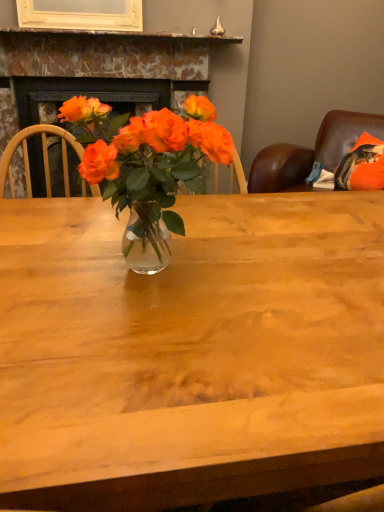
At what (x,y) coordinates should I click in order to perform the action: click on translucent glass vase at center. Please return your answer as a coordinate pair (x, y). Image resolution: width=384 pixels, height=512 pixels. Looking at the image, I should click on click(x=148, y=167).

Based on the photo, what is the approximate height of translucent glass vase at center?

The height of translucent glass vase at center is 38.02 centimeters.

This screenshot has width=384, height=512. What do you see at coordinates (148, 167) in the screenshot?
I see `translucent glass vase at center` at bounding box center [148, 167].

The width and height of the screenshot is (384, 512). Describe the element at coordinates (103, 62) in the screenshot. I see `marble fireplace at upper center` at that location.

I want to click on marble fireplace at upper center, so click(103, 62).

You are a GUI agent. You are given a task and a screenshot of the screen. Output one action in this format:
    pyautogui.click(x=<x>, y=<y>)
    Task: Click on the translucent glass vase at center
    
    Given the screenshot: What is the action you would take?
    pyautogui.click(x=148, y=167)

Does translucent glass vase at center appear on the right side of marble fireplace at upper center?

Correct, you'll find translucent glass vase at center to the right of marble fireplace at upper center.

Which is behind, translucent glass vase at center or marble fireplace at upper center?

marble fireplace at upper center is behind.

Which is less distant, [133,213] or [195,44]?

Positioned in front is point [133,213].

From the image's perspective, does translucent glass vase at center appear higher than marble fireplace at upper center?

No, from the image's perspective, translucent glass vase at center is not over marble fireplace at upper center.

From the picture: From a real-world perspective, who is located lower, translucent glass vase at center or marble fireplace at upper center?

From a 3D spatial view, marble fireplace at upper center is below.

Which of these two, translucent glass vase at center or marble fireplace at upper center, is wider?

marble fireplace at upper center.

Considering the sizes of translucent glass vase at center and marble fireplace at upper center in the image, is translucent glass vase at center taller or shorter than marble fireplace at upper center?

Considering their sizes, translucent glass vase at center has less height than marble fireplace at upper center.

Considering the sizes of objects translucent glass vase at center and marble fireplace at upper center in the image provided, who is bigger, translucent glass vase at center or marble fireplace at upper center?

marble fireplace at upper center is bigger.

Is marble fireplace at upper center surrounded by translucent glass vase at center?

No, translucent glass vase at center does not contain marble fireplace at upper center.

Consider the image. Is translucent glass vase at center next to marble fireplace at upper center?

No, translucent glass vase at center is not making contact with marble fireplace at upper center.

Is translucent glass vase at center looking in the opposite direction of marble fireplace at upper center?

translucent glass vase at center does not have its back to marble fireplace at upper center.

Identify the location of fireplace above the translucent glass vase at center (from the image's perspective). (103, 62).

Is marble fireplace at upper center to the left or to the right of translucent glass vase at center in the image?

In the image, marble fireplace at upper center appears on the left side of translucent glass vase at center.

Is marble fireplace at upper center further to the viewer compared to translucent glass vase at center?

Yes, the depth of marble fireplace at upper center is greater than that of translucent glass vase at center.

Which point is more forward, (12, 110) or (170, 147)?

The point (170, 147) is in front.

From the image's perspective, is marble fireplace at upper center beneath translucent glass vase at center?

No, from the image's perspective, marble fireplace at upper center is not below translucent glass vase at center.

From a real-world perspective, does marble fireplace at upper center sit lower than translucent glass vase at center?

Yes.

Can you confirm if marble fireplace at upper center is wider than translucent glass vase at center?

Yes.

Considering the relative sizes of marble fireplace at upper center and translucent glass vase at center in the image provided, is marble fireplace at upper center shorter than translucent glass vase at center?

In fact, marble fireplace at upper center may be taller than translucent glass vase at center.

In terms of size, does marble fireplace at upper center appear bigger or smaller than translucent glass vase at center?

Clearly, marble fireplace at upper center is larger in size than translucent glass vase at center.

Is marble fireplace at upper center located outside translucent glass vase at center?

marble fireplace at upper center lies outside translucent glass vase at center's area.

Are marble fireplace at upper center and translucent glass vase at center far apart?

Yes, marble fireplace at upper center and translucent glass vase at center are quite far apart.

Could you tell me if marble fireplace at upper center is turned towards translucent glass vase at center?

Yes, marble fireplace at upper center is turned towards translucent glass vase at center.

Measure the distance between marble fireplace at upper center and translucent glass vase at center.

marble fireplace at upper center is 5.55 feet away from translucent glass vase at center.

Where is `houseplant located on the right of marble fireplace at upper center`? houseplant located on the right of marble fireplace at upper center is located at coordinates (148, 167).

This screenshot has width=384, height=512. In order to click on fireplace on the left of the translucent glass vase at center in this screenshot , I will do click(103, 62).

Where is `houseplant on the right of marble fireplace at upper center`? houseplant on the right of marble fireplace at upper center is located at coordinates (148, 167).